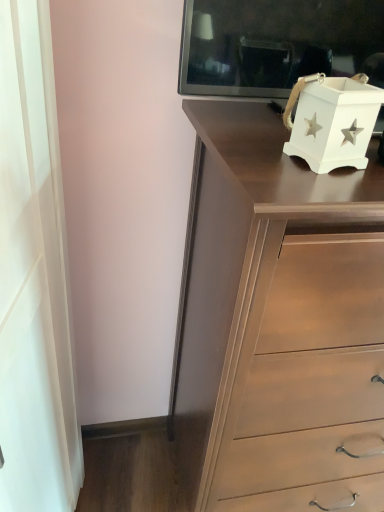
Image resolution: width=384 pixels, height=512 pixels. Describe the element at coordinates (34, 276) in the screenshot. I see `white matte curtain at left` at that location.

The width and height of the screenshot is (384, 512). Describe the element at coordinates (332, 120) in the screenshot. I see `white matte box at upper right` at that location.

Where is `white matte curtain at left`? The width and height of the screenshot is (384, 512). white matte curtain at left is located at coordinates (34, 276).

Is matte brown chest of drawers at center oriented towards white matte box at upper right?

No, matte brown chest of drawers at center is not aimed at white matte box at upper right.

How different are the orientations of matte brown chest of drawers at center and white matte box at upper right in degrees?

They differ by 8.38 degrees in their facing directions.

Considering the sizes of matte brown chest of drawers at center and white matte box at upper right in the image, is matte brown chest of drawers at center wider or thinner than white matte box at upper right?

Clearly, matte brown chest of drawers at center has more width compared to white matte box at upper right.

Which is behind, matte brown chest of drawers at center or white matte box at upper right?

white matte box at upper right is further away from the camera.

Considering the relative sizes of white matte box at upper right and white matte curtain at left in the image provided, is white matte box at upper right thinner than white matte curtain at left?

No.

Is white matte box at upper right bigger than white matte curtain at left?

No, white matte box at upper right is not bigger than white matte curtain at left.

Is white matte box at upper right taller than white matte curtain at left?

No, white matte box at upper right is not taller than white matte curtain at left.

In the scene shown: Could you tell me if white matte box at upper right is facing white matte curtain at left?

No, white matte box at upper right does not turn towards white matte curtain at left.

How different are the orientations of matte brown chest of drawers at center and white matte curtain at left in degrees?

77.4 degrees.

Between matte brown chest of drawers at center and white matte curtain at left, which one is positioned behind?

white matte curtain at left.

Is point (254, 120) more distant than point (55, 390)?

No.

Which point is more forward, (17,193) or (369,136)?

The point (369,136) is closer.

Do you think white matte curtain at left is within white matte box at upper right, or outside of it?

white matte curtain at left is located beyond the bounds of white matte box at upper right.

Between white matte curtain at left and white matte box at upper right, which one is positioned behind?

white matte curtain at left is behind.

How different are the orientations of white matte curtain at left and white matte box at upper right in degrees?

The angular difference between white matte curtain at left and white matte box at upper right is 69 degrees.

Considering their positions, is white matte box at upper right located in front of or behind matte brown chest of drawers at center?

Visually, white matte box at upper right is located behind matte brown chest of drawers at center.

Is white matte box at upper right facing towards matte brown chest of drawers at center?

No, white matte box at upper right is not oriented towards matte brown chest of drawers at center.

How distant is white matte box at upper right from matte brown chest of drawers at center?

They are 13.70 inches apart.

Between white matte box at upper right and matte brown chest of drawers at center, which one has smaller size?

white matte box at upper right.

Is there a large distance between white matte curtain at left and matte brown chest of drawers at center?

No, white matte curtain at left is not far from matte brown chest of drawers at center.

Based on the photo, from the image's perspective, is white matte curtain at left above matte brown chest of drawers at center?

Indeed, from the image's perspective, white matte curtain at left is shown above matte brown chest of drawers at center.

Which is less distant, (60, 170) or (183, 365)?

Clearly, point (60, 170) is closer to the camera than point (183, 365).

Considering the relative sizes of white matte curtain at left and matte brown chest of drawers at center in the image provided, is white matte curtain at left smaller than matte brown chest of drawers at center?

Yes, white matte curtain at left is smaller than matte brown chest of drawers at center.

Where is `box located above the matte brown chest of drawers at center (from a real-world perspective)`? box located above the matte brown chest of drawers at center (from a real-world perspective) is located at coordinates [332, 120].

The image size is (384, 512). Identify the location of box that appears in front of the white matte curtain at left. (332, 120).

From the image, which object appears to be farther from white matte curtain at left, matte brown chest of drawers at center or white matte box at upper right?

Based on the image, white matte box at upper right appears to be further to white matte curtain at left.

From the image, which object appears to be farther from white matte curtain at left, white matte box at upper right or matte brown chest of drawers at center?

The object further to white matte curtain at left is white matte box at upper right.

From the image, which object appears to be farther from white matte box at upper right, matte brown chest of drawers at center or white matte curtain at left?

Among the two, white matte curtain at left is located further to white matte box at upper right.

Considering their positions, is white matte curtain at left positioned closer to white matte box at upper right than matte brown chest of drawers at center?

matte brown chest of drawers at center is positioned closer to the anchor white matte box at upper right.

Looking at the image, which one is located further to matte brown chest of drawers at center, white matte curtain at left or white matte box at upper right?

white matte curtain at left is positioned further to the anchor matte brown chest of drawers at center.

Considering their positions, is white matte box at upper right positioned closer to matte brown chest of drawers at center than white matte curtain at left?

white matte box at upper right is positioned closer to the anchor matte brown chest of drawers at center.

Where is `box between white matte curtain at left and matte brown chest of drawers at center in the horizontal direction`? The image size is (384, 512). box between white matte curtain at left and matte brown chest of drawers at center in the horizontal direction is located at coordinates click(332, 120).